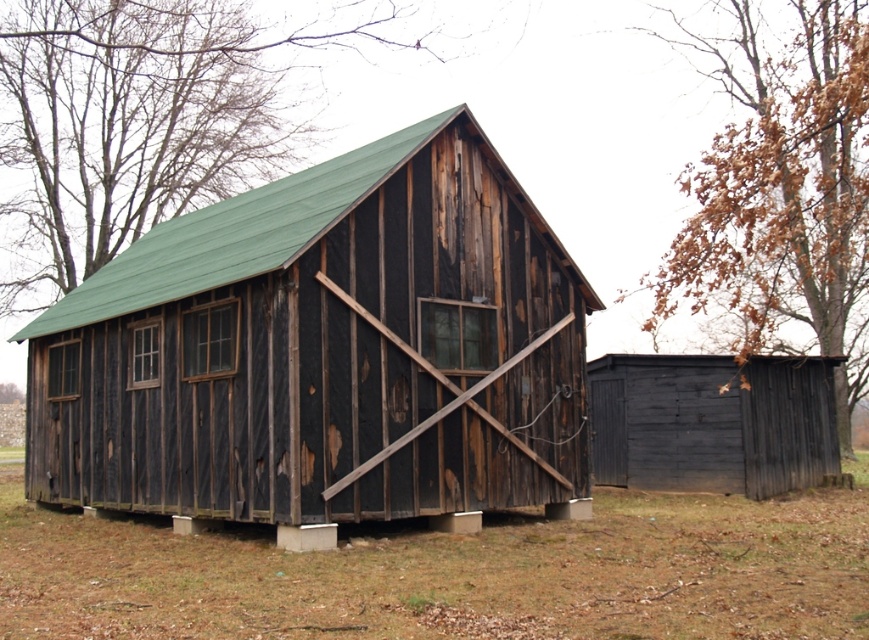
Question: Which object is farther from the camera taking this photo?

Choices:
 (A) rusty wood barn at center
 (B) green wood tree at upper center
 (C) dark brown wooden shed at right
 (D) brown wood tree at upper right

Answer: (C)

Question: Which of these objects is positioned closest to the brown wood tree at upper right?

Choices:
 (A) dark brown wooden shed at right
 (B) rusty wood barn at center

Answer: (B)

Question: Where is rusty wood barn at center located in relation to green wood tree at upper center in the image?

Choices:
 (A) above
 (B) below

Answer: (B)

Question: Which object is the closest to the brown wood tree at upper right?

Choices:
 (A) green wood tree at upper center
 (B) dark brown wooden shed at right
 (C) rusty wood barn at center

Answer: (C)

Question: Can you confirm if rusty wood barn at center is positioned to the right of dark brown wooden shed at right?

Choices:
 (A) yes
 (B) no

Answer: (B)

Question: Does green wood tree at upper center have a smaller size compared to dark brown wooden shed at right?

Choices:
 (A) yes
 (B) no

Answer: (B)